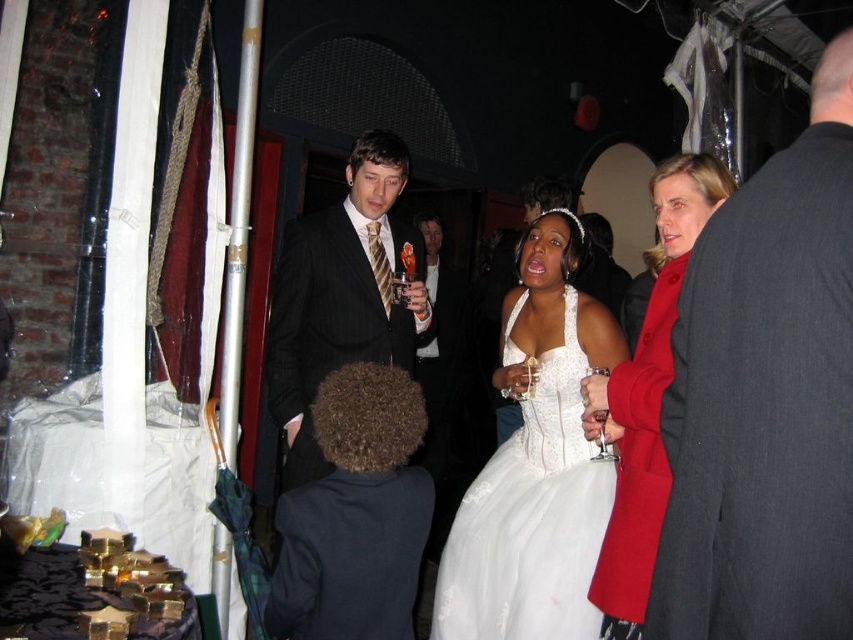
You are a photographer at the event and need to frame a shot that includes both the dark gray suit at right and the dark brown curly hair at center. Since you want to ensure both are visible without cropping, which object should you adjust your camera angle to prioritize in terms of width?

The dark gray suit at right has a smaller width compared to the dark brown curly hair at center. To include both without cropping, prioritize positioning the camera to accommodate the wider dark brown curly hair at center first.

You are a photographer at the event and need to adjust the lighting so that the dark gray suit at right and the dark brown curly hair at center are both well lit. Based on their positions, which object should you focus on first to ensure proper exposure?

The dark gray suit at right is located above dark brown curly hair at center, so you should focus on the dark brown curly hair at center first since it is lower and might be in shadow, ensuring it gets enough light before adjusting for the upper area.

You are a photographer at the event and need to capture a photo of the dark brown curly hair at center and the pinstripe suit at center. Based on their sizes, which one should you focus on first to ensure both are in frame?

The dark brown curly hair at center is thinner than the pinstripe suit at center, so you should focus on the pinstripe suit at center first to ensure both fit in the frame.